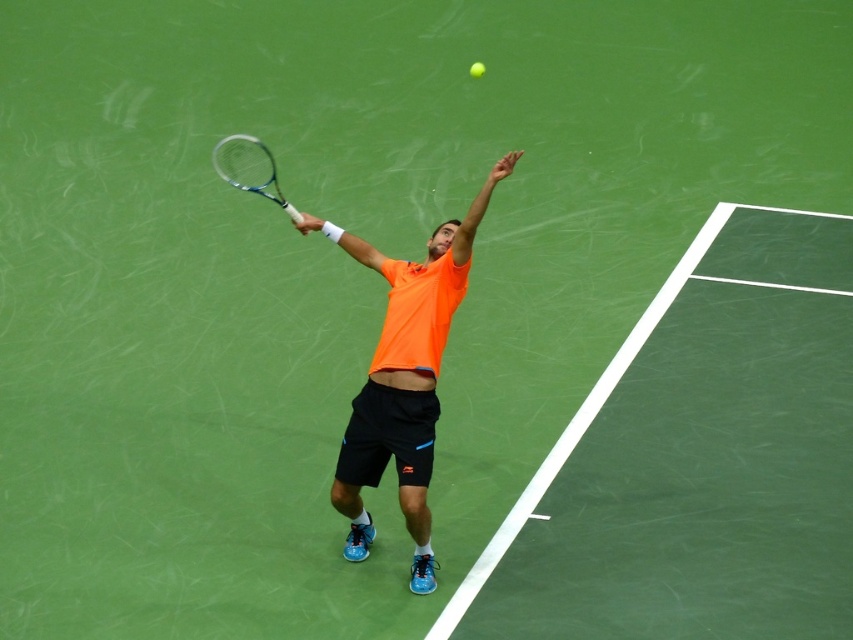
You are a tennis coach observing a player during a practice session. You notice the silver metallic tennis racket at upper center and the green matte tennis ball at upper center in the image. Which object has a greater width?

The silver metallic tennis racket at upper center has a greater width than the green matte tennis ball at upper center.

You are a tennis coach observing a player preparing to serve. You notice the silver metallic tennis racket at upper center and the green matte tennis ball at upper center. Which object is larger in size?

The silver metallic tennis racket at upper center is bigger than the green matte tennis ball at upper center.